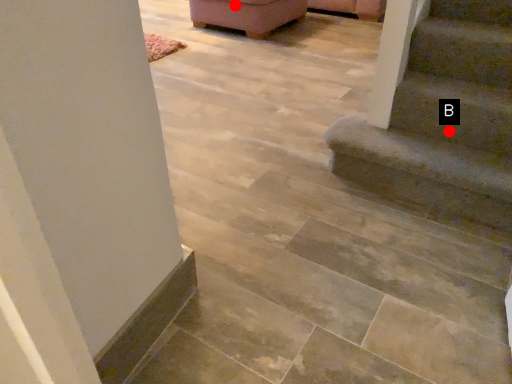
Question: Two points are circled on the image, labeled by A and B beside each circle. Among these points, which one is nearest to the camera?

Choices:
 (A) A is closer
 (B) B is closer

Answer: (B)